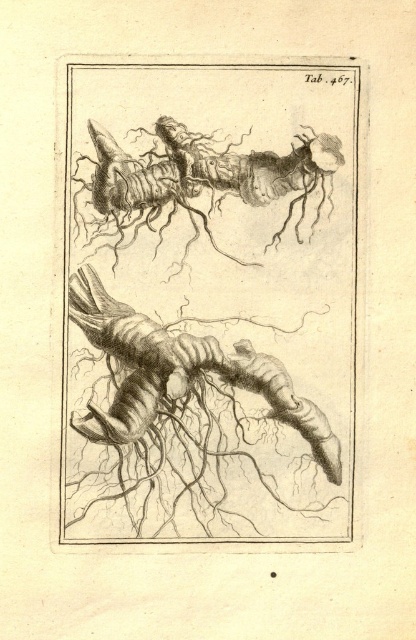
Question: Which of the following is the farthest from the observer?

Choices:
 (A) etched wood roots at center
 (B) smooth black insect at center

Answer: (B)

Question: Does etched wood roots at center appear on the right side of smooth black insect at center?

Choices:
 (A) no
 (B) yes

Answer: (A)

Question: Which point is farther from the camera taking this photo?

Choices:
 (A) (74, 506)
 (B) (195, 138)

Answer: (B)

Question: Observing the image, what is the correct spatial positioning of etched wood roots at center in reference to smooth black insect at center?

Choices:
 (A) below
 (B) above

Answer: (A)

Question: Where is etched wood roots at center located in relation to smooth black insect at center in the image?

Choices:
 (A) above
 (B) below

Answer: (B)

Question: Which of the following is the closest to the observer?

Choices:
 (A) etched wood roots at center
 (B) smooth black insect at center

Answer: (A)